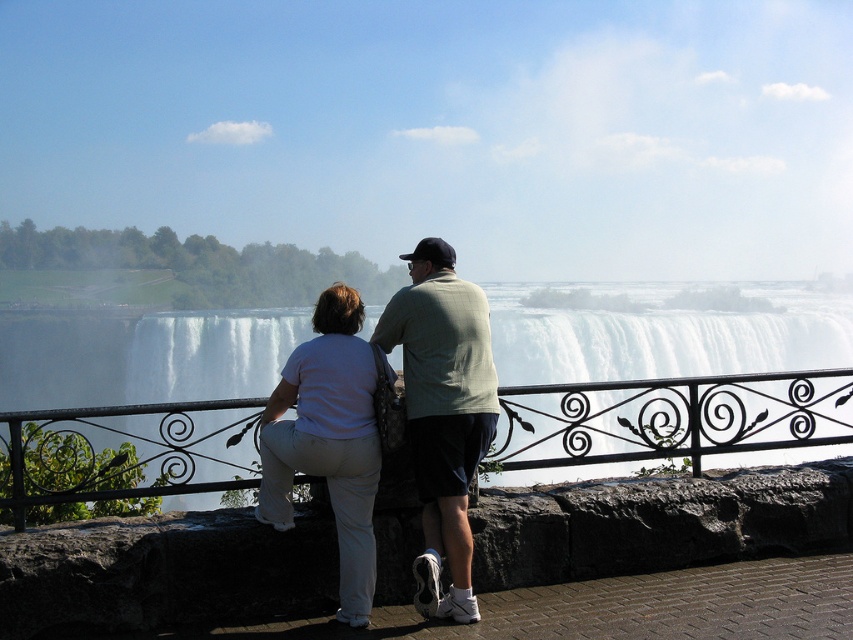
You are a photographer trying to capture a photo of the white frothy water at center and the white cotton pants at center. Which object is wider in the image?

The white frothy water at center is wider than the white cotton pants at center.

You are a photographer trying to capture the best shot of the light green cotton shirt at center and white cotton pants at center. Since you want to include both in the frame, which one should you position closer to the left side of your camera viewfinder to ensure they both fit?

To include both the light green cotton shirt at center and the white cotton pants at center in the frame, position the white cotton pants at center closer to the left side of the camera viewfinder. This is because the light green cotton shirt at center is already to the right of the white cotton pants at center, so adjusting their positioning in the viewfinder will help capture both subjects effectively.

In the scene shown: You are a photographer trying to capture a photo of the light green cotton shirt at center and the white cotton pants at center. Since you want to focus on the clothing items, which one should you adjust your camera lens to focus on first, considering their height?

The light green cotton shirt at center has a greater height compared to the white cotton pants at center, so you should adjust your camera lens to focus on the light green cotton shirt at center first.